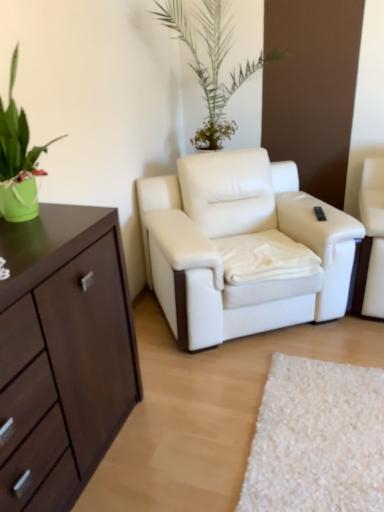
Question: Is black plastic remote control at upper right thinner than green matte pot at left?

Choices:
 (A) yes
 (B) no

Answer: (A)

Question: Considering the relative sizes of black plastic remote control at upper right and green matte pot at left in the image provided, is black plastic remote control at upper right smaller than green matte pot at left?

Choices:
 (A) no
 (B) yes

Answer: (B)

Question: From the image's perspective, is black plastic remote control at upper right below green matte pot at left?

Choices:
 (A) yes
 (B) no

Answer: (A)

Question: From a real-world perspective, does black plastic remote control at upper right sit lower than green matte pot at left?

Choices:
 (A) no
 (B) yes

Answer: (B)

Question: Is black plastic remote control at upper right located outside green matte pot at left?

Choices:
 (A) no
 (B) yes

Answer: (B)

Question: Looking at their shapes, would you say green matte pot at left is wider or thinner than black plastic remote control at upper right?

Choices:
 (A) thin
 (B) wide

Answer: (B)

Question: Looking at the image, does green matte pot at left seem bigger or smaller compared to black plastic remote control at upper right?

Choices:
 (A) big
 (B) small

Answer: (A)

Question: From a real-world perspective, relative to black plastic remote control at upper right, is green matte pot at left vertically above or below?

Choices:
 (A) below
 (B) above

Answer: (B)

Question: Is green matte pot at left inside or outside of black plastic remote control at upper right?

Choices:
 (A) inside
 (B) outside

Answer: (B)

Question: Considering the positions of white leather armchair at center and black plastic remote control at upper right in the image, is white leather armchair at center bigger or smaller than black plastic remote control at upper right?

Choices:
 (A) small
 (B) big

Answer: (B)

Question: Considering their positions, is white leather armchair at center located in front of or behind black plastic remote control at upper right?

Choices:
 (A) behind
 (B) front

Answer: (B)

Question: Is white leather armchair at center inside the boundaries of black plastic remote control at upper right, or outside?

Choices:
 (A) outside
 (B) inside

Answer: (A)

Question: From the image's perspective, is white leather armchair at center located above or below black plastic remote control at upper right?

Choices:
 (A) above
 (B) below

Answer: (B)

Question: From a real-world perspective, is white leather armchair at center positioned above or below green matte pot at left?

Choices:
 (A) below
 (B) above

Answer: (A)

Question: From the image's perspective, is white leather armchair at center above or below green matte pot at left?

Choices:
 (A) below
 (B) above

Answer: (A)